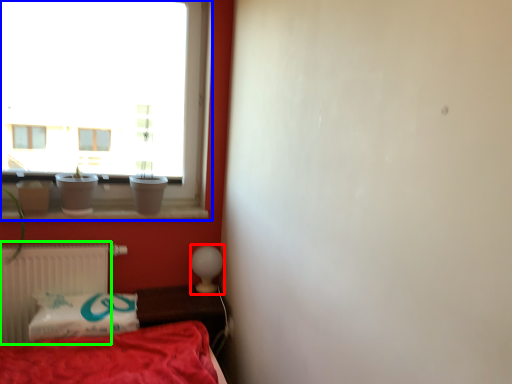
Question: Which object is the closest to the table lamp (highlighted by a red box)? Choose among these: window (highlighted by a blue box) or radiator (highlighted by a green box).

Choices:
 (A) window
 (B) radiator

Answer: (B)